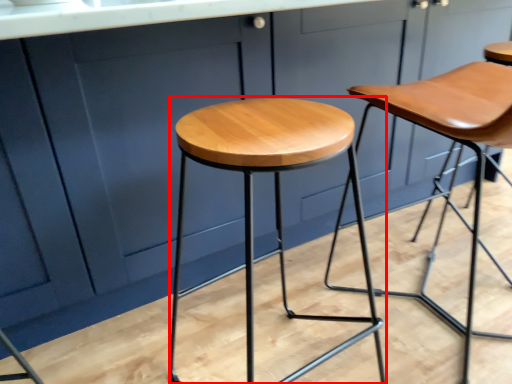
Question: From the image's perspective, what is the correct spatial positioning of stool (annotated by the red box) in reference to stool?

Choices:
 (A) above
 (B) below

Answer: (B)